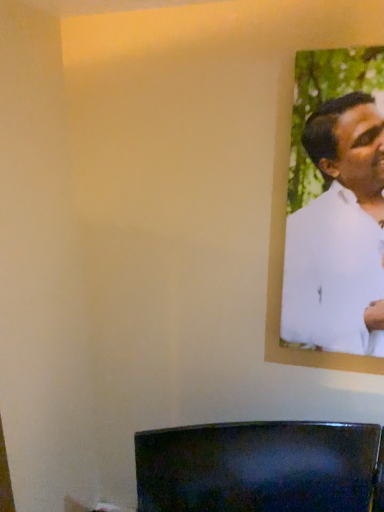
What is the approximate width of glossy black tv at lower center?

→ It is 1.65 inches.

What do you see at coordinates (257, 467) in the screenshot? I see `glossy black tv at lower center` at bounding box center [257, 467].

Locate an element on the screen. The height and width of the screenshot is (512, 384). glossy black tv at lower center is located at coordinates (257, 467).

What is the approximate width of white matte shirt at upper right?

white matte shirt at upper right is 1.26 inches in width.

The image size is (384, 512). Describe the element at coordinates (339, 234) in the screenshot. I see `white matte shirt at upper right` at that location.

The image size is (384, 512). Identify the location of white matte shirt at upper right. (339, 234).

Find the location of `glossy black tv at lower center`. glossy black tv at lower center is located at coordinates (257, 467).

Does glossy black tv at lower center appear on the right side of white matte shirt at upper right?

Incorrect, glossy black tv at lower center is not on the right side of white matte shirt at upper right.

Which object is further away from the camera, glossy black tv at lower center or white matte shirt at upper right?

glossy black tv at lower center is further away from the camera.

Which is nearer, (298, 511) or (372, 169)?

The point (372, 169) is closer.

Based on the photo, from the image's perspective, which object appears higher, glossy black tv at lower center or white matte shirt at upper right?

white matte shirt at upper right is shown above in the image.

From a real-world perspective, which is physically above, glossy black tv at lower center or white matte shirt at upper right?

white matte shirt at upper right, from a real-world perspective.

Is glossy black tv at lower center wider or thinner than white matte shirt at upper right?

glossy black tv at lower center is wider than white matte shirt at upper right.

Does glossy black tv at lower center have a lesser height compared to white matte shirt at upper right?

Correct, glossy black tv at lower center is not as tall as white matte shirt at upper right.

Can you confirm if glossy black tv at lower center is smaller than white matte shirt at upper right?

No, glossy black tv at lower center is not smaller than white matte shirt at upper right.

Would you say glossy black tv at lower center contains white matte shirt at upper right?

No.

Are glossy black tv at lower center and white matte shirt at upper right located far from each other?

That's not correct — glossy black tv at lower center is a little close to white matte shirt at upper right.

Is glossy black tv at lower center turned away from white matte shirt at upper right?

glossy black tv at lower center is not turned away from white matte shirt at upper right.

This screenshot has height=512, width=384. In the image, there is a glossy black tv at lower center. In order to click on man above it (from the image's perspective) in this screenshot , I will do `click(339, 234)`.

Is white matte shirt at upper right to the left of glossy black tv at lower center from the viewer's perspective?

No, white matte shirt at upper right is not to the left of glossy black tv at lower center.

Considering the relative positions of white matte shirt at upper right and glossy black tv at lower center in the image provided, is white matte shirt at upper right behind glossy black tv at lower center?

No, it is in front of glossy black tv at lower center.

Which is closer, (290, 227) or (188, 468)?

The point (290, 227) is closer to the camera.

From the image's perspective, which object appears higher, white matte shirt at upper right or glossy black tv at lower center?

white matte shirt at upper right appears higher in the image.

From a real-world perspective, between white matte shirt at upper right and glossy black tv at lower center, who is vertically lower?

glossy black tv at lower center, from a real-world perspective.

Is white matte shirt at upper right thinner than glossy black tv at lower center?

Indeed, white matte shirt at upper right has a lesser width compared to glossy black tv at lower center.

Based on the photo, is white matte shirt at upper right taller than glossy black tv at lower center?

Yes, white matte shirt at upper right is taller than glossy black tv at lower center.

Between white matte shirt at upper right and glossy black tv at lower center, which one has larger size?

glossy black tv at lower center.

Would you say white matte shirt at upper right is outside glossy black tv at lower center?

Yes.

Based on the photo, are white matte shirt at upper right and glossy black tv at lower center beside each other?

No, white matte shirt at upper right is not next to glossy black tv at lower center.

Is white matte shirt at upper right looking in the opposite direction of glossy black tv at lower center?

No, white matte shirt at upper right's orientation is not away from glossy black tv at lower center.

Can you tell me how much white matte shirt at upper right and glossy black tv at lower center differ in facing direction?

The facing directions of white matte shirt at upper right and glossy black tv at lower center are 19 degrees apart.

Identify the location of man that appears above the glossy black tv at lower center (from a real-world perspective). (339, 234).

Identify the location of furniture below the white matte shirt at upper right (from the image's perspective). (257, 467).

Identify the location of furniture that is on the left side of white matte shirt at upper right. This screenshot has width=384, height=512. (257, 467).